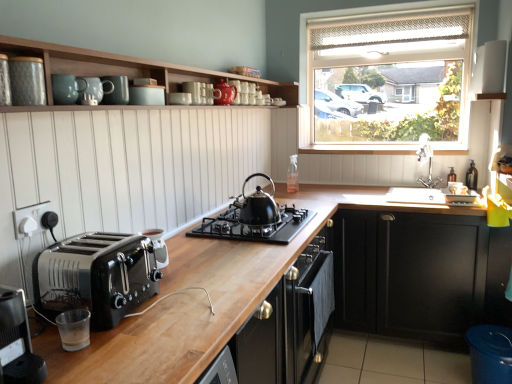
You are a GUI agent. You are given a task and a screenshot of the screen. Output one action in this format:
    pyautogui.click(x=<x>, y=<y>)
    Task: Click on the free spot to the right of black metallic toaster at lower left, the 5th appliance positioned from the left
    The image size is (512, 384).
    Given the screenshot: What is the action you would take?
    pyautogui.click(x=197, y=262)